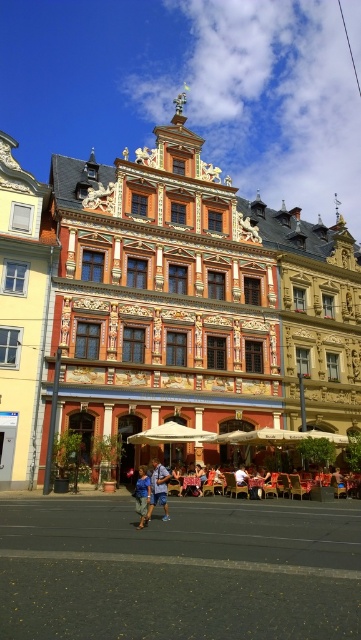
Question: Which object is positioned closest to the blue denim shorts at center?

Choices:
 (A) blue denim shorts at lower center
 (B) wooden carved building at center

Answer: (A)

Question: Can you confirm if blue denim shorts at center is thinner than blue denim shorts at lower center?

Choices:
 (A) yes
 (B) no

Answer: (A)

Question: Is blue denim shorts at center below blue denim shorts at lower center?

Choices:
 (A) no
 (B) yes

Answer: (A)

Question: Which object is farther from the camera taking this photo?

Choices:
 (A) wooden carved building at center
 (B) blue denim shorts at center
 (C) blue denim shorts at lower center

Answer: (A)

Question: Which point is farther to the camera?

Choices:
 (A) (142, 467)
 (B) (284, 288)
 (C) (163, 483)

Answer: (B)

Question: Is blue denim shorts at center bigger than blue denim shorts at lower center?

Choices:
 (A) no
 (B) yes

Answer: (A)